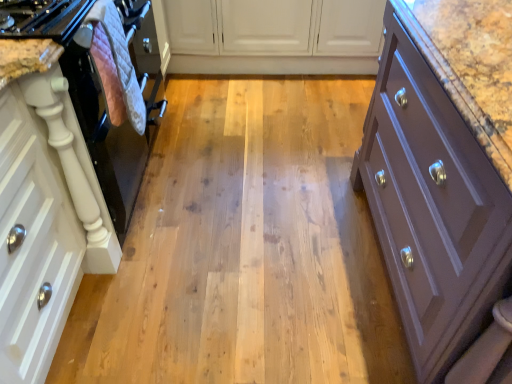
Describe the element at coordinates (44, 209) in the screenshot. I see `white matte cabinet at left, which is counted as the first cabinetry, starting from the left` at that location.

Locate an element on the screen. The image size is (512, 384). white matte cabinet at left, which is counted as the third cabinetry, starting from the right is located at coordinates (44, 209).

In the scene shown: Is black glossy oven at left positioned beyond the bounds of purple matte cabinet at right, the 1th cabinetry when ordered from right to left?

Indeed, black glossy oven at left is completely outside purple matte cabinet at right, the 1th cabinetry when ordered from right to left.

Which is in front, black glossy oven at left or purple matte cabinet at right, the 3th cabinetry positioned from the left?

purple matte cabinet at right, the 3th cabinetry positioned from the left.

Which point is more forward, (114, 203) or (440, 62)?

Positioned in front is point (440, 62).

Could you tell me if black glossy oven at left is turned towards pink quilted oven mitt at left?

Yes, black glossy oven at left is aimed at pink quilted oven mitt at left.

Considering the relative sizes of black glossy oven at left and pink quilted oven mitt at left in the image provided, is black glossy oven at left shorter than pink quilted oven mitt at left?

No, black glossy oven at left is not shorter than pink quilted oven mitt at left.

Would you consider black glossy oven at left to be distant from pink quilted oven mitt at left?

black glossy oven at left is actually quite close to pink quilted oven mitt at left.

Is black glossy oven at left spatially inside pink quilted oven mitt at left, or outside of it?

black glossy oven at left is located beyond the bounds of pink quilted oven mitt at left.

From the image's perspective, is white matte cabinet at left, which is counted as the third cabinetry, starting from the right, above or below pink quilted oven mitt at left?

From the image's perspective, white matte cabinet at left, which is counted as the third cabinetry, starting from the right, appears below pink quilted oven mitt at left.

Is white matte cabinet at left, which is counted as the third cabinetry, starting from the right, spatially inside pink quilted oven mitt at left, or outside of it?

white matte cabinet at left, which is counted as the third cabinetry, starting from the right, cannot be found inside pink quilted oven mitt at left.

Considering the sizes of white matte cabinet at left, which is counted as the third cabinetry, starting from the right, and pink quilted oven mitt at left in the image, is white matte cabinet at left, which is counted as the third cabinetry, starting from the right, wider or thinner than pink quilted oven mitt at left?

In the image, white matte cabinet at left, which is counted as the third cabinetry, starting from the right, appears to be wider than pink quilted oven mitt at left.

Based on their positions, is white matte cabinet at left, which is counted as the third cabinetry, starting from the right, located to the left or right of pink quilted oven mitt at left?

white matte cabinet at left, which is counted as the third cabinetry, starting from the right, is positioned on pink quilted oven mitt at left's left side.

Does purple matte cabinet at right, the 1th cabinetry when ordered from right to left, have a greater width compared to black glossy oven at left?

Yes.

Is there a large distance between purple matte cabinet at right, the 1th cabinetry when ordered from right to left, and black glossy oven at left?

Actually, purple matte cabinet at right, the 1th cabinetry when ordered from right to left, and black glossy oven at left are a little close together.

Which of these two, purple matte cabinet at right, the 3th cabinetry positioned from the left, or black glossy oven at left, is smaller?

black glossy oven at left.

Which is behind, purple matte cabinet at right, the 3th cabinetry positioned from the left, or black glossy oven at left?

Positioned behind is black glossy oven at left.

How many degrees apart are the facing directions of white matte cabinet at center, the second cabinetry from the left, and white matte cabinet at left, which is counted as the third cabinetry, starting from the right?

They differ by 89.8 degrees in their facing directions.

From the image's perspective, is white matte cabinet at center, which is the 2th cabinetry in right-to-left order, located beneath white matte cabinet at left, which is counted as the first cabinetry, starting from the left?

No, from the image's perspective, white matte cabinet at center, which is the 2th cabinetry in right-to-left order, is not beneath white matte cabinet at left, which is counted as the first cabinetry, starting from the left.

In order to click on the 2nd cabinetry below the white matte cabinet at center, which is the 2th cabinetry in right-to-left order (from the image's perspective) in this screenshot , I will do `click(44, 209)`.

In the image, is white matte cabinet at center, the second cabinetry from the left, on the left side or the right side of white matte cabinet at left, which is counted as the first cabinetry, starting from the left?

white matte cabinet at center, the second cabinetry from the left, is to the right of white matte cabinet at left, which is counted as the first cabinetry, starting from the left.

From a real-world perspective, which object rests below the other?

In real-world perspective, white matte cabinet at center, which is the 2th cabinetry in right-to-left order, is lower.

Between white matte cabinet at center, which is the 2th cabinetry in right-to-left order, and black glossy oven at left, which one appears on the right side from the viewer's perspective?

white matte cabinet at center, which is the 2th cabinetry in right-to-left order, is more to the right.

The width and height of the screenshot is (512, 384). In order to click on cabinetry beneath the black glossy oven at left (from a real-world perspective) in this screenshot , I will do `click(270, 36)`.

Is white matte cabinet at center, which is the 2th cabinetry in right-to-left order, closer to the viewer compared to black glossy oven at left?

No, it is not.

Is white matte cabinet at left, which is counted as the third cabinetry, starting from the right, touching purple matte cabinet at right, the 3th cabinetry positioned from the left?

No, white matte cabinet at left, which is counted as the third cabinetry, starting from the right, is not touching purple matte cabinet at right, the 3th cabinetry positioned from the left.

What are the coordinates of `cabinetry in front of the white matte cabinet at left, which is counted as the first cabinetry, starting from the left` in the screenshot? It's located at (442, 170).

Considering the sizes of objects white matte cabinet at left, which is counted as the first cabinetry, starting from the left, and purple matte cabinet at right, the 3th cabinetry positioned from the left, in the image provided, who is shorter, white matte cabinet at left, which is counted as the first cabinetry, starting from the left, or purple matte cabinet at right, the 3th cabinetry positioned from the left,?

white matte cabinet at left, which is counted as the first cabinetry, starting from the left.

Which object is wider, white matte cabinet at left, which is counted as the third cabinetry, starting from the right, or purple matte cabinet at right, the 1th cabinetry when ordered from right to left?

purple matte cabinet at right, the 1th cabinetry when ordered from right to left, is wider.

The image size is (512, 384). What are the coordinates of `cabinetry that is the 2nd one above the black glossy oven at left (from a real-world perspective)` in the screenshot? It's located at (442, 170).

You are a GUI agent. You are given a task and a screenshot of the screen. Output one action in this format:
    pyautogui.click(x=<x>, y=<y>)
    Task: Click on the oven lying on the left of pink quilted oven mitt at left
    The image size is (512, 384).
    Given the screenshot: What is the action you would take?
    pyautogui.click(x=114, y=108)

Based on their spatial positions, is purple matte cabinet at right, the 3th cabinetry positioned from the left, or pink quilted oven mitt at left further from white matte cabinet at center, which is the 2th cabinetry in right-to-left order?

Based on the image, purple matte cabinet at right, the 3th cabinetry positioned from the left, appears to be further to white matte cabinet at center, which is the 2th cabinetry in right-to-left order.

Considering their positions, is white matte cabinet at center, which is the 2th cabinetry in right-to-left order, positioned further to white matte cabinet at left, which is counted as the first cabinetry, starting from the left, than black glossy oven at left?

white matte cabinet at center, which is the 2th cabinetry in right-to-left order, is further to white matte cabinet at left, which is counted as the first cabinetry, starting from the left.

Which object lies nearer to the anchor point pink quilted oven mitt at left, purple matte cabinet at right, the 1th cabinetry when ordered from right to left, or white matte cabinet at center, which is the 2th cabinetry in right-to-left order?

purple matte cabinet at right, the 1th cabinetry when ordered from right to left.

Estimate the real-world distances between objects in this image. Which object is closer to black glossy oven at left, white matte cabinet at left, which is counted as the third cabinetry, starting from the right, or purple matte cabinet at right, the 3th cabinetry positioned from the left?

white matte cabinet at left, which is counted as the third cabinetry, starting from the right, lies closer to black glossy oven at left than the other object.

Considering their positions, is pink quilted oven mitt at left positioned further to purple matte cabinet at right, the 3th cabinetry positioned from the left, than white matte cabinet at center, the second cabinetry from the left?

white matte cabinet at center, the second cabinetry from the left, lies further to purple matte cabinet at right, the 3th cabinetry positioned from the left, than the other object.

Estimate the real-world distances between objects in this image. Which object is further from white matte cabinet at left, which is counted as the first cabinetry, starting from the left, black glossy oven at left or purple matte cabinet at right, the 3th cabinetry positioned from the left?

purple matte cabinet at right, the 3th cabinetry positioned from the left.

Based on their spatial positions, is black glossy oven at left or pink quilted oven mitt at left further from white matte cabinet at left, which is counted as the third cabinetry, starting from the right?

Among the two, pink quilted oven mitt at left is located further to white matte cabinet at left, which is counted as the third cabinetry, starting from the right.

Estimate the real-world distances between objects in this image. Which object is closer to white matte cabinet at center, which is the 2th cabinetry in right-to-left order, black glossy oven at left or white matte cabinet at left, which is counted as the third cabinetry, starting from the right?

Based on the image, black glossy oven at left appears to be nearer to white matte cabinet at center, which is the 2th cabinetry in right-to-left order.

I want to click on oven between white matte cabinet at left, which is counted as the first cabinetry, starting from the left, and purple matte cabinet at right, the 1th cabinetry when ordered from right to left, from left to right, so click(x=114, y=108).

Where is `material between white matte cabinet at left, which is counted as the third cabinetry, starting from the right, and purple matte cabinet at right, the 3th cabinetry positioned from the left, in the horizontal direction`? This screenshot has height=384, width=512. material between white matte cabinet at left, which is counted as the third cabinetry, starting from the right, and purple matte cabinet at right, the 3th cabinetry positioned from the left, in the horizontal direction is located at coordinates (121, 61).

I want to click on material between purple matte cabinet at right, the 3th cabinetry positioned from the left, and white matte cabinet at center, the second cabinetry from the left, along the z-axis, so click(x=121, y=61).

You are a GUI agent. You are given a task and a screenshot of the screen. Output one action in this format:
    pyautogui.click(x=<x>, y=<y>)
    Task: Click on the material between white matte cabinet at left, which is counted as the third cabinetry, starting from the right, and white matte cabinet at center, which is the 2th cabinetry in right-to-left order, from front to back
    This screenshot has width=512, height=384.
    Given the screenshot: What is the action you would take?
    pyautogui.click(x=121, y=61)